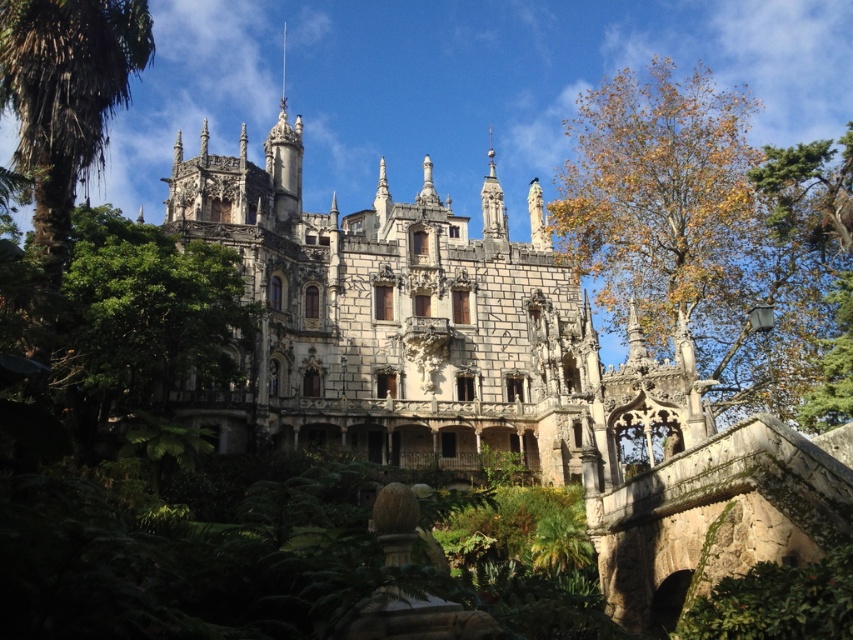
Which is above, yellow-green leaves at upper right or green leafy palm at upper left?

yellow-green leaves at upper right is above.

Is point (799, 321) behind point (109, 88)?

Yes, it is.

Between point (820, 148) and point (134, 51), which one is positioned in front?

Positioned in front is point (134, 51).

The height and width of the screenshot is (640, 853). Find the location of `yellow-green leaves at upper right`. yellow-green leaves at upper right is located at coordinates (717, 236).

Measure the distance between point [503,273] and camera.

313.40 feet

This screenshot has height=640, width=853. Identify the location of stone castle at center. (421, 326).

Does stone castle at center have a lesser width compared to green leafy palm at upper left?

No, stone castle at center is not thinner than green leafy palm at upper left.

Can you confirm if stone castle at center is taller than green leafy palm at upper left?

Indeed, stone castle at center has a greater height compared to green leafy palm at upper left.

Based on the photo, who is more distant from viewer, (312, 275) or (38, 243)?

The point (312, 275) is more distant.

Locate an element on the screen. The height and width of the screenshot is (640, 853). stone castle at center is located at coordinates (421, 326).